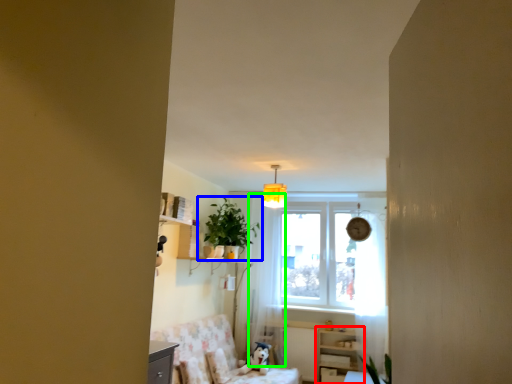
Question: Which object is the closest to the dresser (highlighted by a red box)? Choose among these: houseplant (highlighted by a blue box) or curtain (highlighted by a green box).

Choices:
 (A) houseplant
 (B) curtain

Answer: (B)